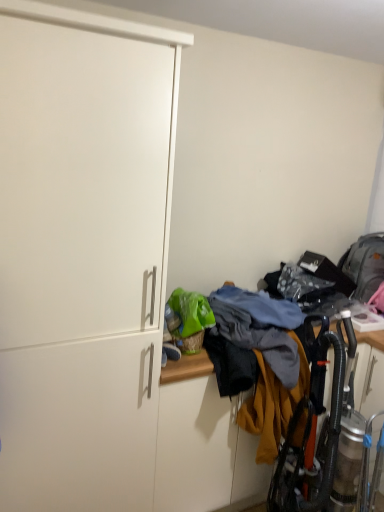
You are a GUI agent. You are given a task and a screenshot of the screen. Output one action in this format:
    pyautogui.click(x=<x>, y=<y>)
    Task: Click on the multicolored fabric at lower right
    
    Given the screenshot: What is the action you would take?
    pyautogui.click(x=186, y=369)

Measure the distance between multicolored fabric at lower right and camera.

multicolored fabric at lower right and camera are 2.38 meters apart.

Describe the element at coordinates (186, 369) in the screenshot. This screenshot has height=512, width=384. I see `multicolored fabric at lower right` at that location.

The width and height of the screenshot is (384, 512). What do you see at coordinates (82, 253) in the screenshot? I see `white matte cabinet at left` at bounding box center [82, 253].

Find the location of `white matte cabinet at left`. white matte cabinet at left is located at coordinates (82, 253).

In order to face white matte cabinet at left, should I rotate leftwards or rightwards?

Turn left by 15.357 degrees to look at white matte cabinet at left.

In order to click on multicolored fabric at lower right in this screenshot , I will do `click(186, 369)`.

Which is more to the right, multicolored fabric at lower right or white matte cabinet at left?

Positioned to the right is multicolored fabric at lower right.

Considering the positions of objects multicolored fabric at lower right and white matte cabinet at left in the image provided, who is behind, multicolored fabric at lower right or white matte cabinet at left?

multicolored fabric at lower right is more distant.

Considering the points (381, 340) and (24, 480), which point is behind, point (381, 340) or point (24, 480)?

Point (381, 340)

From the image's perspective, is multicolored fabric at lower right located above or below white matte cabinet at left?

Clearly, from the image's perspective, multicolored fabric at lower right is below white matte cabinet at left.

From a real-world perspective, which is physically above, multicolored fabric at lower right or white matte cabinet at left?

From a 3D spatial view, white matte cabinet at left is above.

Considering the relative sizes of multicolored fabric at lower right and white matte cabinet at left in the image provided, is multicolored fabric at lower right thinner than white matte cabinet at left?

No.

Can you confirm if multicolored fabric at lower right is taller than white matte cabinet at left?

No, multicolored fabric at lower right is not taller than white matte cabinet at left.

Does multicolored fabric at lower right have a smaller size compared to white matte cabinet at left?

Yes.

Would you say multicolored fabric at lower right contains white matte cabinet at left?

No, white matte cabinet at left is located outside of multicolored fabric at lower right.

Is multicolored fabric at lower right positioned far away from white matte cabinet at left?

multicolored fabric at lower right is far away from white matte cabinet at left.

Is multicolored fabric at lower right facing towards white matte cabinet at left?

No, multicolored fabric at lower right is not turned towards white matte cabinet at left.

How different are the orientations of multicolored fabric at lower right and white matte cabinet at left in degrees?

1.3 degrees.

How far apart are multicolored fabric at lower right and white matte cabinet at left?

multicolored fabric at lower right and white matte cabinet at left are 4.81 feet apart from each other.

Where is `cabinetry located in front of the multicolored fabric at lower right`? cabinetry located in front of the multicolored fabric at lower right is located at coordinates (82, 253).

Would you say white matte cabinet at left is to the left or to the right of multicolored fabric at lower right in the picture?

white matte cabinet at left is positioned on multicolored fabric at lower right's left side.

Based on the photo, is the position of white matte cabinet at left less distant than that of multicolored fabric at lower right?

Yes, white matte cabinet at left is closer to the camera.

Is point (31, 485) more distant than point (176, 378)?

No, it is not.

From the image's perspective, is white matte cabinet at left on multicolored fabric at lower right?

Indeed, from the image's perspective, white matte cabinet at left is shown above multicolored fabric at lower right.

From a real-world perspective, is white matte cabinet at left on top of multicolored fabric at lower right?

Yes.

Is white matte cabinet at left wider than multicolored fabric at lower right?

No.

Considering the sizes of white matte cabinet at left and multicolored fabric at lower right in the image, is white matte cabinet at left taller or shorter than multicolored fabric at lower right?

Clearly, white matte cabinet at left is taller compared to multicolored fabric at lower right.

Based on their sizes in the image, would you say white matte cabinet at left is bigger or smaller than multicolored fabric at lower right?

Clearly, white matte cabinet at left is larger in size than multicolored fabric at lower right.

Can multicolored fabric at lower right be found inside white matte cabinet at left?

No, multicolored fabric at lower right is located outside of white matte cabinet at left.

Is white matte cabinet at left far away from multicolored fabric at lower right?

Absolutely, white matte cabinet at left is distant from multicolored fabric at lower right.

Based on the photo, does white matte cabinet at left turn towards multicolored fabric at lower right?

No, white matte cabinet at left is not aimed at multicolored fabric at lower right.

How many degrees apart are the facing directions of white matte cabinet at left and multicolored fabric at lower right?

white matte cabinet at left and multicolored fabric at lower right are facing 1.3 degrees away from each other.

Identify the location of laundry located on the right of white matte cabinet at left. This screenshot has height=512, width=384. (186, 369).

The image size is (384, 512). Identify the location of laundry behind the white matte cabinet at left. (186, 369).

Where is `cabinetry to the left of multicolored fabric at lower right`? The width and height of the screenshot is (384, 512). cabinetry to the left of multicolored fabric at lower right is located at coordinates [x=82, y=253].